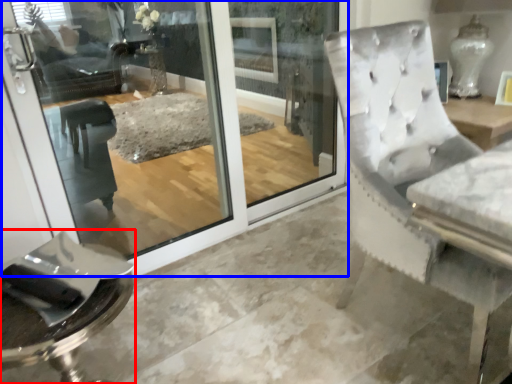
Question: Which of the following is the farthest to the observer, furniture (highlighted by a red box) or screen door (highlighted by a blue box)?

Choices:
 (A) furniture
 (B) screen door

Answer: (B)